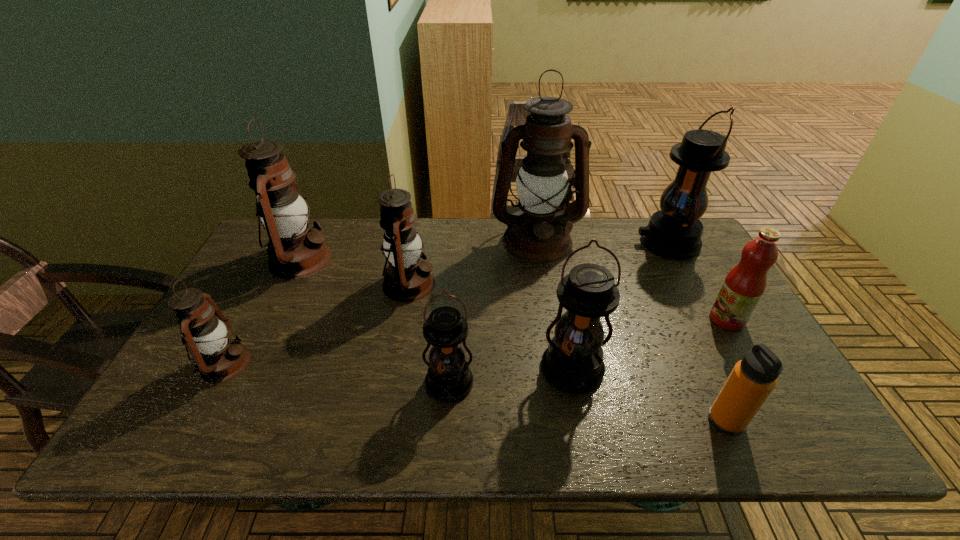
What are the coordinates of `the closest brown lantern relative to the second biggest brown lantern` in the screenshot? It's located at (407, 278).

The height and width of the screenshot is (540, 960). I want to click on the second closest brown lantern to the third smallest brown lantern, so click(218, 358).

Locate an element on the screen. This screenshot has height=540, width=960. black lantern that stands as the third closest to the third brown lantern from left to right is located at coordinates (674, 232).

Identify which black lantern is located as the nearest to the pink fruit juice. Please provide its 2D coordinates. Your answer should be formatted as a tuple, i.e. [(x, y)], where the tuple contains the x and y coordinates of a point satisfying the conditions above.

[(674, 232)]

At what (x,y) coordinates should I click in order to perform the action: click on vacant space that satisfies the following two spatial constraints: 1. above the second smallest black lantern, indicating its light source; 2. on the right side of the orange thermos bottle. Please return your answer as a coordinate pair (x, y). Image resolution: width=960 pixels, height=540 pixels. Looking at the image, I should click on (583, 420).

In order to click on vacant point that satisfies the following two spatial constraints: 1. above the second biggest black lantern, indicating its light source; 2. on the right side of the orange thermos bottle in this screenshot , I will do `click(583, 420)`.

The height and width of the screenshot is (540, 960). Identify the location of free point that satisfies the following two spatial constraints: 1. on the side of the second biggest brown lantern, there is a wick adjustment knob; 2. on the back side of the shortest object. (222, 420).

The image size is (960, 540). What are the coordinates of `free space that satisfies the following two spatial constraints: 1. on the front label of the fruit juice; 2. on the front side of the orange thermos bottle` in the screenshot? It's located at (785, 420).